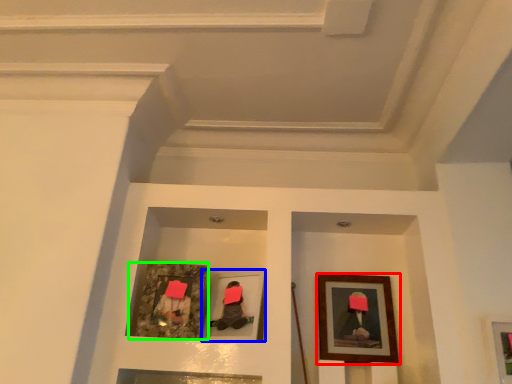
Question: Which is farther away from picture frame (highlighted by a red box)? picture frame (highlighted by a blue box) or picture frame (highlighted by a green box)?

Choices:
 (A) picture frame
 (B) picture frame

Answer: (B)